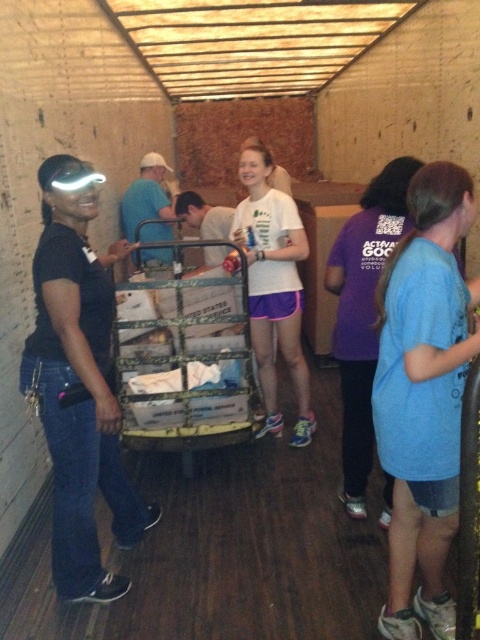
Question: Which object is farther from the camera taking this photo?

Choices:
 (A) matte black shirt at left
 (B) blue cotton shirt at right

Answer: (A)

Question: Which point is closer to the camera taking this photo?

Choices:
 (A) (47, 362)
 (B) (430, 339)
 (C) (269, 422)
 (D) (129, 429)

Answer: (B)

Question: Is matte black shirt at left to the right of camouflage metal trolley at center from the viewer's perspective?

Choices:
 (A) no
 (B) yes

Answer: (A)

Question: Which object is farther from the camera taking this photo?

Choices:
 (A) matte black shirt at left
 (B) camouflage metal trolley at center
 (C) blue cotton shirt at right
 (D) white matte t-shirt at center

Answer: (D)

Question: Is blue cotton shirt at right wider than matte black shirt at left?

Choices:
 (A) yes
 (B) no

Answer: (B)

Question: Is camouflage metal trolley at center thinner than white matte t-shirt at center?

Choices:
 (A) no
 (B) yes

Answer: (A)